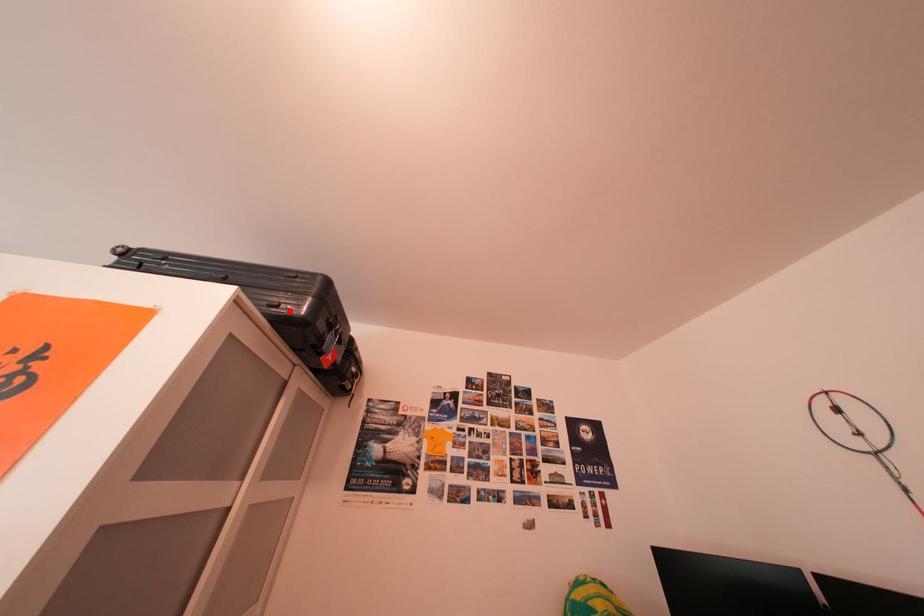
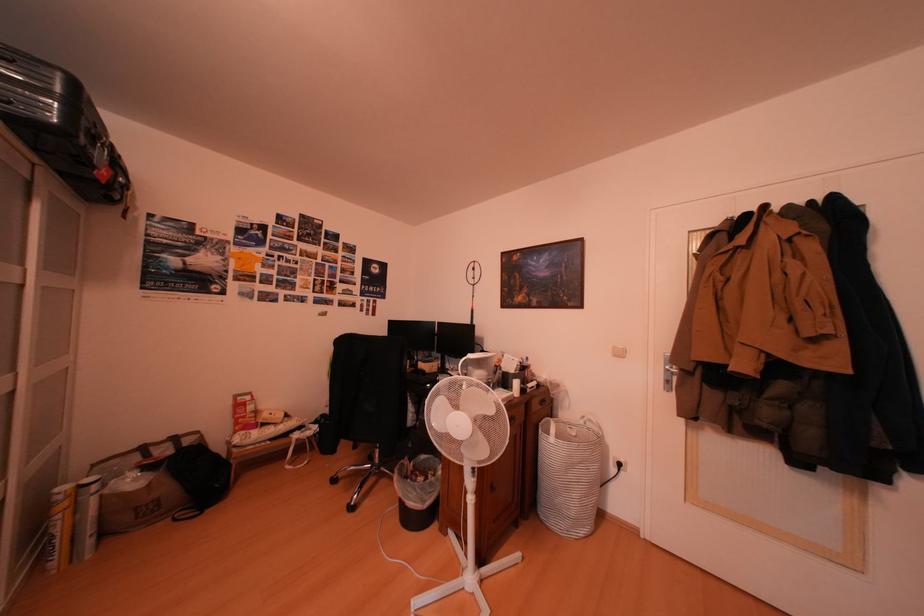
Question: I am providing you with two images of the same scene from different viewpoints. A red point is marked on the first image. At the location where the point appears in image 1, is it still visible in image 2?

Choices:
 (A) Yes
 (B) No

Answer: (A)